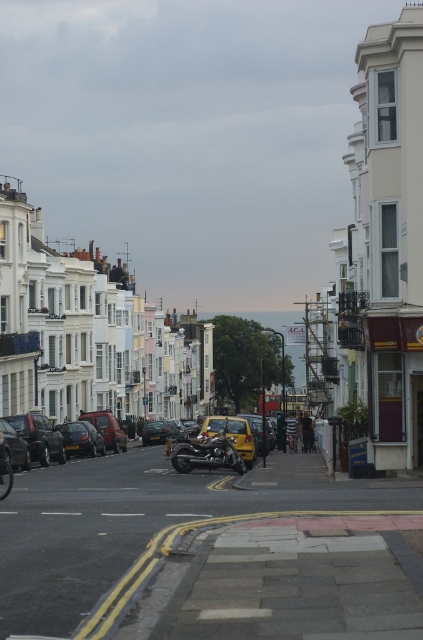
From the picture: You are a pedestrian standing at the starting point of the street. You want to cross the road to reach the sea visible at the horizon. There is a matte black car at center left represented by point (38, 436). Is there enough space between the matte black car at center left and the nearest parked car to your right to safely cross the road?

The space between the matte black car at center left and the nearest parked car to your right is sufficient for safe crossing as the distance is more than 1.5 meters.